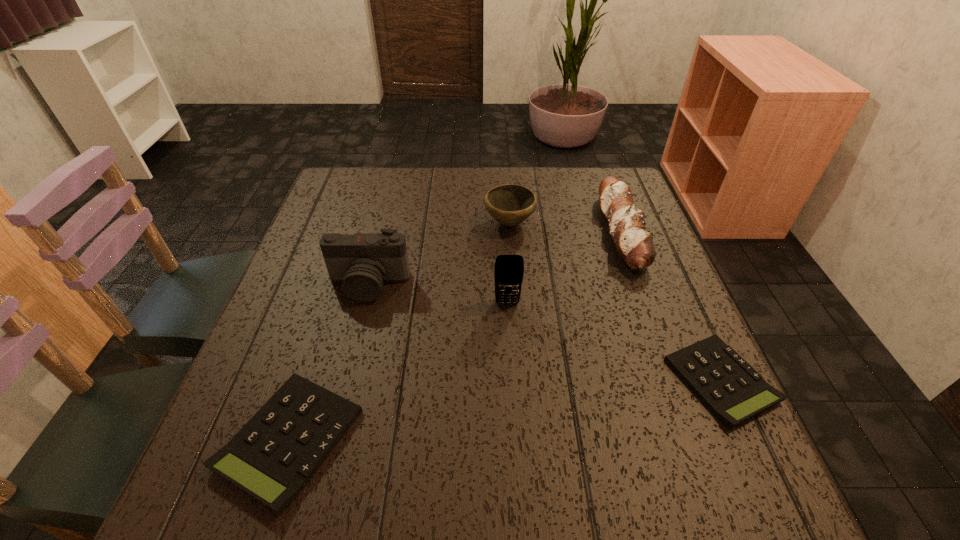
What are the coordinates of `vacant space that satisfies the following two spatial constraints: 1. on the screen of the cellular telephone; 2. on the left side of the right calculator` in the screenshot? It's located at (512, 380).

At what (x,y) coordinates should I click in order to perform the action: click on free spot that satisfies the following two spatial constraints: 1. on the back side of the taller calculator; 2. on the left side of the right calculator. Please return your answer as a coordinate pair (x, y). This screenshot has width=960, height=540. Looking at the image, I should click on (x=309, y=380).

At what (x,y) coordinates should I click in order to perform the action: click on vacant area in the image that satisfies the following two spatial constraints: 1. on the screen of the cellular telephone; 2. on the right side of the shorter calculator. Please return your answer as a coordinate pair (x, y). The width and height of the screenshot is (960, 540). Looking at the image, I should click on (512, 380).